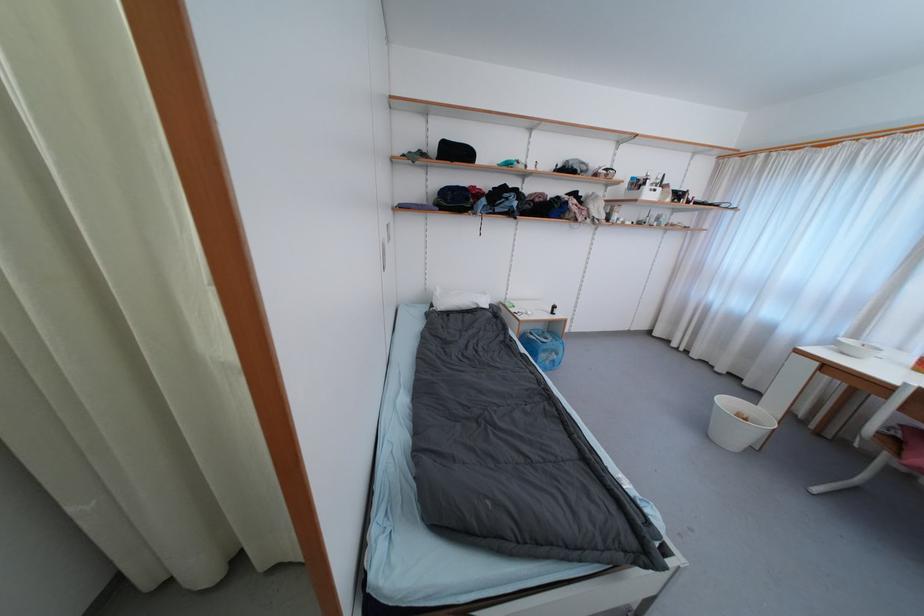
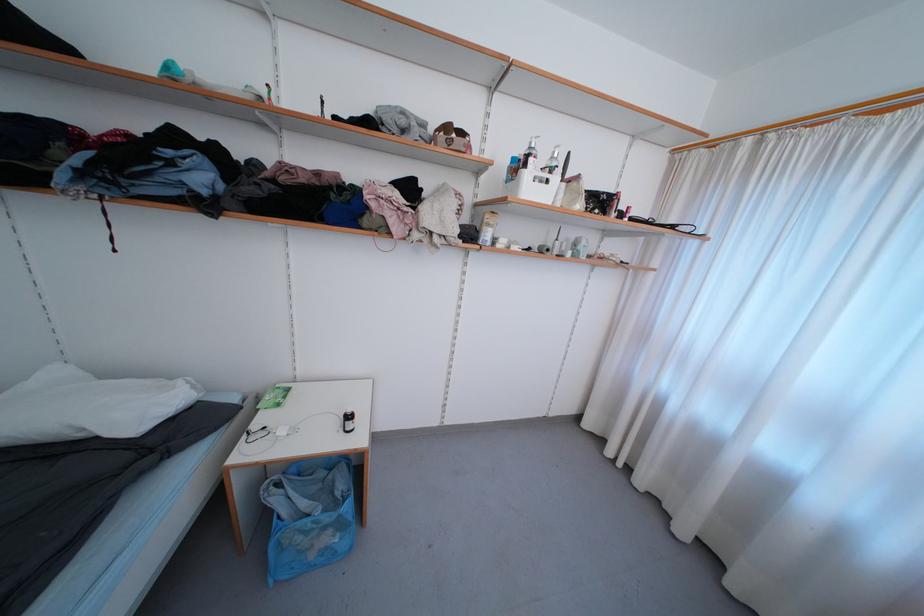
The point at (650, 191) is marked in the first image. Where is the corresponding point in the second image?

(531, 177)